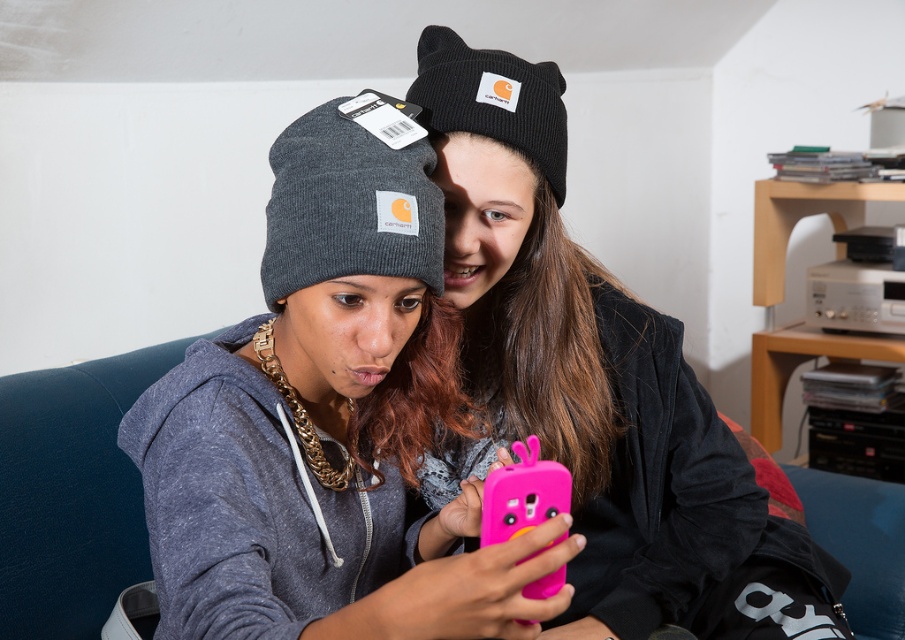
Question: Considering the relative positions of matte black beanie at center and pink rubber phone case at center in the image provided, where is matte black beanie at center located with respect to pink rubber phone case at center?

Choices:
 (A) above
 (B) below

Answer: (A)

Question: Which of the following is the farthest from the observer?

Choices:
 (A) matte black beanie at center
 (B) matte gray beanie at center

Answer: (A)

Question: Does matte black beanie at center appear under pink rubber phone case at center?

Choices:
 (A) no
 (B) yes

Answer: (A)

Question: Which object appears closest to the camera in this image?

Choices:
 (A) pink rubber phone case at center
 (B) matte black beanie at center
 (C) matte gray beanie at center

Answer: (C)

Question: Is matte black beanie at center below pink rubber phone case at center?

Choices:
 (A) no
 (B) yes

Answer: (A)

Question: Which object appears farthest from the camera in this image?

Choices:
 (A) pink rubber phone case at center
 (B) matte gray beanie at center

Answer: (A)